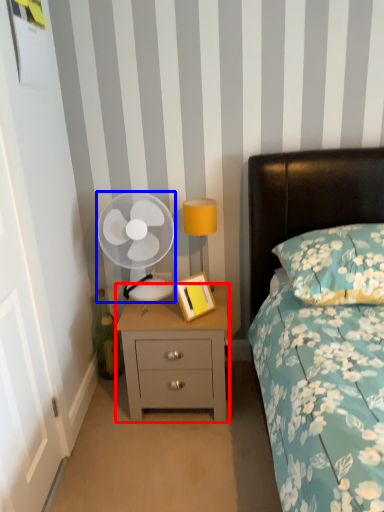
Question: Which object appears farthest to the camera in this image, nightstand (highlighted by a red box) or mechanical fan (highlighted by a blue box)?

Choices:
 (A) nightstand
 (B) mechanical fan

Answer: (B)